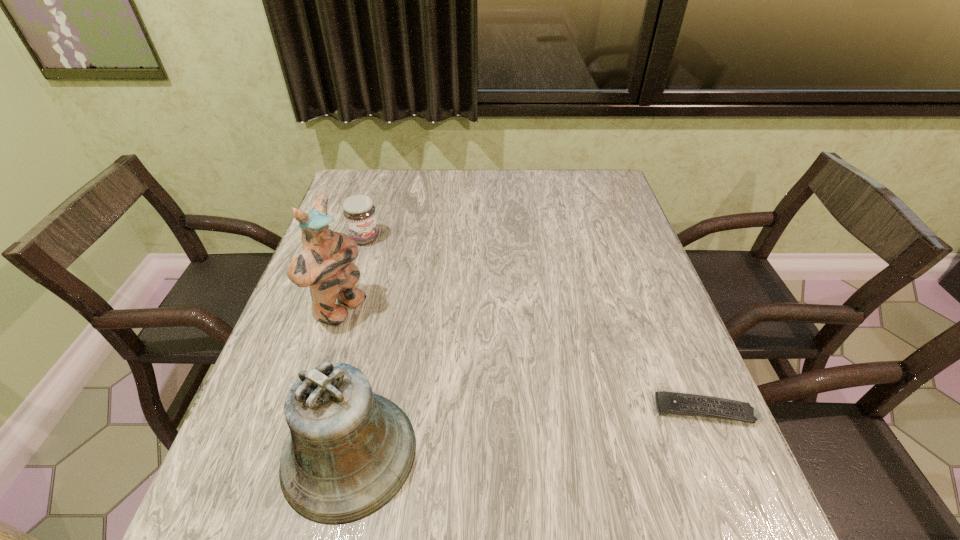
The image size is (960, 540). Identify the location of vacant space located on the front label of the second shortest object. (394, 272).

Identify the location of vacant space located on the front label of the second shortest object. (394, 272).

At what (x,y) coordinates should I click in order to perform the action: click on vacant space located on the front-facing side of the tallest object. Please return your answer as a coordinate pair (x, y). The height and width of the screenshot is (540, 960). Looking at the image, I should click on (414, 353).

At what (x,y) coordinates should I click in order to perform the action: click on vacant space located 0.050m on the front-facing side of the tallest object. Please return your answer as a coordinate pair (x, y). The height and width of the screenshot is (540, 960). Looking at the image, I should click on (375, 332).

The height and width of the screenshot is (540, 960). I want to click on free space located on the front-facing side of the tallest object, so click(468, 381).

Where is `bell that is positioned at the near edge`? bell that is positioned at the near edge is located at coordinates (349, 452).

You are a GUI agent. You are given a task and a screenshot of the screen. Output one action in this format:
    pyautogui.click(x=<x>, y=<y>)
    Task: Click on the remote control present at the near edge
    
    Given the screenshot: What is the action you would take?
    [x=675, y=403]

Find the location of a particular element. bell located at the left edge is located at coordinates (349, 452).

Identify the location of jam that is at the left edge. (359, 212).

The width and height of the screenshot is (960, 540). Identify the location of figurine present at the left edge. (325, 264).